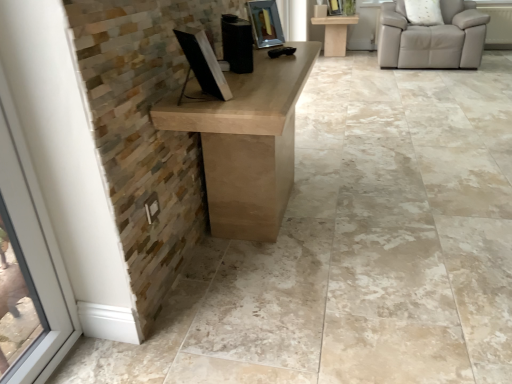
Question: Considering the relative positions of matte beige table at upper center and beige leather chair at upper right in the image provided, is matte beige table at upper center to the left of beige leather chair at upper right from the viewer's perspective?

Choices:
 (A) no
 (B) yes

Answer: (B)

Question: From a real-world perspective, is matte beige table at upper center physically above beige leather chair at upper right?

Choices:
 (A) yes
 (B) no

Answer: (B)

Question: Is matte beige table at upper center positioned far away from beige leather chair at upper right?

Choices:
 (A) yes
 (B) no

Answer: (A)

Question: Is matte beige table at upper center behind beige leather chair at upper right?

Choices:
 (A) no
 (B) yes

Answer: (B)

Question: Does matte beige table at upper center have a greater width compared to beige leather chair at upper right?

Choices:
 (A) yes
 (B) no

Answer: (A)

Question: Is black matte speaker at center in front of or behind beige leather chair at upper right in the image?

Choices:
 (A) front
 (B) behind

Answer: (A)

Question: Is point (226, 49) positioned closer to the camera than point (464, 16)?

Choices:
 (A) farther
 (B) closer

Answer: (B)

Question: Considering the relative positions of black matte speaker at center and beige leather chair at upper right in the image provided, is black matte speaker at center to the left or to the right of beige leather chair at upper right?

Choices:
 (A) right
 (B) left

Answer: (B)

Question: Is black matte speaker at center bigger or smaller than beige leather chair at upper right?

Choices:
 (A) big
 (B) small

Answer: (B)

Question: Is black matte speaker at center inside or outside of matte beige table at upper center?

Choices:
 (A) outside
 (B) inside

Answer: (A)

Question: Is black matte speaker at center to the left or to the right of matte beige table at upper center in the image?

Choices:
 (A) left
 (B) right

Answer: (A)

Question: From the image's perspective, is black matte speaker at center above or below matte beige table at upper center?

Choices:
 (A) below
 (B) above

Answer: (A)

Question: From a real-world perspective, is black matte speaker at center physically located above or below matte beige table at upper center?

Choices:
 (A) above
 (B) below

Answer: (A)

Question: In the image, is matte beige table at upper center on the left side or the right side of beige leather chair at upper right?

Choices:
 (A) left
 (B) right

Answer: (A)

Question: From a real-world perspective, is matte beige table at upper center positioned above or below beige leather chair at upper right?

Choices:
 (A) below
 (B) above

Answer: (A)